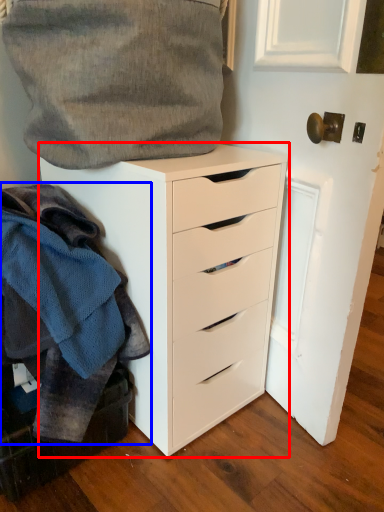
Question: Which of the following is the farthest to the observer, chest of drawers (highlighted by a red box) or clothing (highlighted by a blue box)?

Choices:
 (A) chest of drawers
 (B) clothing

Answer: (A)